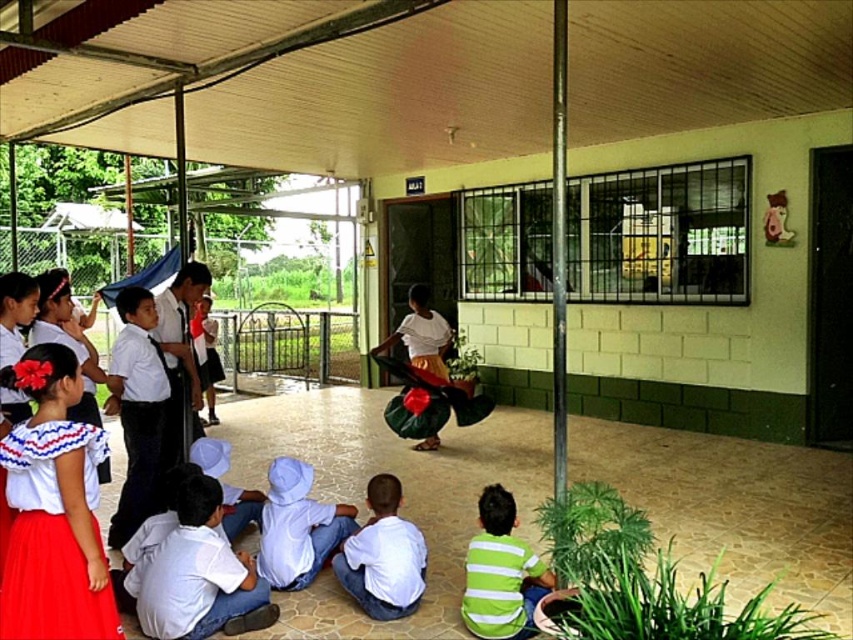
You are standing at the center of the image where the young girl is dancing. You want to walk directly to the point marked at coordinates (502, 573). What object will you encounter first along your path?

You will first encounter the green striped shirt at lower right because the point marked at coordinates (502, 573) is located on the green striped shirt at lower right.

You are a photographer standing in front of the scene. You need to capture a photo that includes both the matte white blouse at lower left and the white matte shirt at lower center. Which object should you focus on first to ensure both are in frame?

You should focus on the matte white blouse at lower left first because it is closer to the viewer than the white matte shirt at lower center, so adjusting the camera to include both would require starting with the closer object.

You are a photographer standing at the back of the scene. You need to capture a photo where both the green striped shirt at lower right and the white cotton shirt at center are fully visible. Considering their heights, which shirt should you focus on to ensure both are in frame?

The green striped shirt at lower right is shorter than the white cotton shirt at center. To ensure both are fully visible, focus on the white cotton shirt at center as it is taller, allowing the shorter green striped shirt at lower right to remain in view.